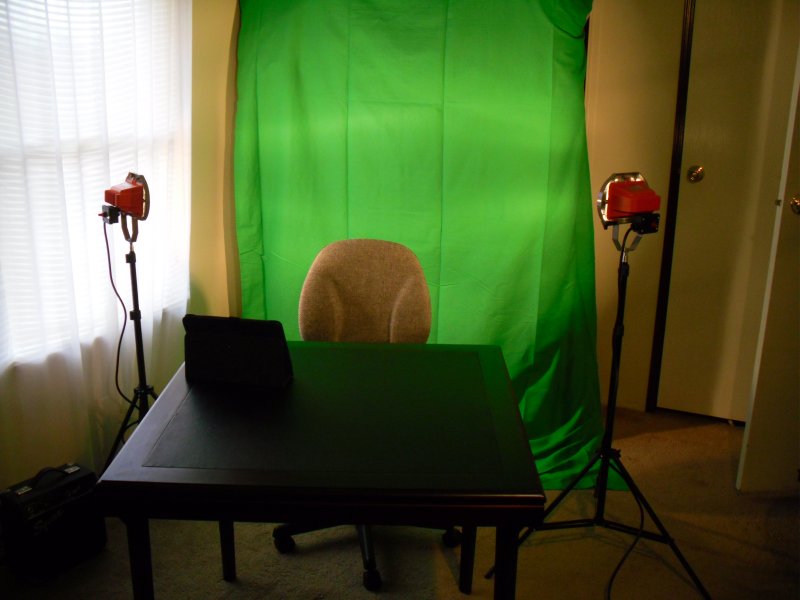
I want to click on carpet, so click(698, 496).